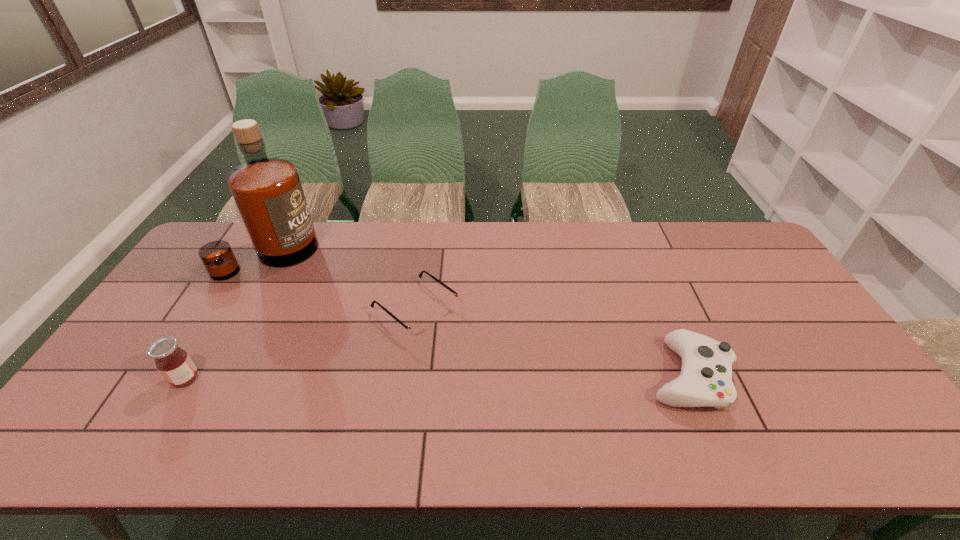
Locate an element on the screen. The width and height of the screenshot is (960, 540). object that is at the far left corner is located at coordinates (267, 192).

In the image, there is a desktop. At what (x,y) coordinates should I click in order to perform the action: click on vacant space at the far edge. Please return your answer as a coordinate pair (x, y). Looking at the image, I should click on (668, 246).

Where is `vacant area at the near edge of the desktop`? vacant area at the near edge of the desktop is located at coordinates (226, 393).

You are a GUI agent. You are given a task and a screenshot of the screen. Output one action in this format:
    pyautogui.click(x=<x>, y=<y>)
    Task: Click on the vacant region at the right edge of the desktop
    
    Given the screenshot: What is the action you would take?
    pyautogui.click(x=796, y=331)

In the image, there is a desktop. Identify the location of vacant space at the far left corner. (242, 230).

Where is `empty space that is in between the liquor and the third shortest object`? This screenshot has height=540, width=960. empty space that is in between the liquor and the third shortest object is located at coordinates (227, 317).

Locate an element on the screen. vacant area that lies between the tallest object and the control is located at coordinates (479, 315).

The width and height of the screenshot is (960, 540). I want to click on vacant area between the jam and the tallest object, so click(227, 317).

This screenshot has height=540, width=960. In order to click on free space between the liquor and the control in this screenshot , I will do `click(479, 315)`.

Find the location of a particular element. free space between the third tallest object and the tallest object is located at coordinates (479, 315).